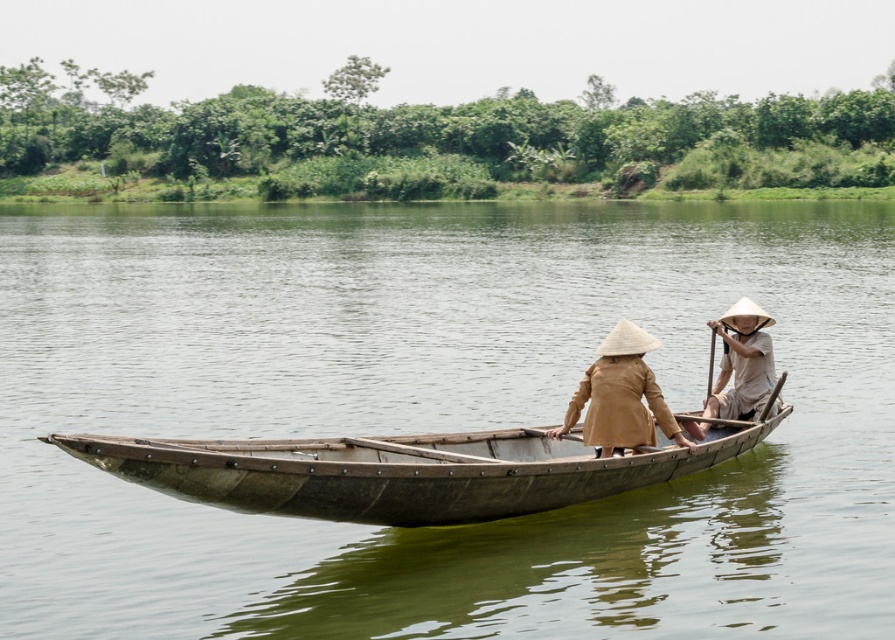
Identify the location of wooden canoe at center. Image resolution: width=895 pixels, height=640 pixels. (398, 472).

The image size is (895, 640). What do you see at coordinates (398, 472) in the screenshot? I see `wooden canoe at center` at bounding box center [398, 472].

Locate an element on the screen. This screenshot has width=895, height=640. wooden canoe at center is located at coordinates (398, 472).

Between brown matte conical hat at center and light brown wooden paddle at right, which one appears on the right side from the viewer's perspective?

light brown wooden paddle at right is more to the right.

The width and height of the screenshot is (895, 640). What do you see at coordinates (621, 396) in the screenshot?
I see `brown matte conical hat at center` at bounding box center [621, 396].

At what (x,y) coordinates should I click in order to perform the action: click on brown matte conical hat at center. Please return your answer as a coordinate pair (x, y). The image size is (895, 640). Looking at the image, I should click on (621, 396).

Is point (297, 493) behind point (744, 396)?

No, it is in front of (744, 396).

Is wooden canoe at center further to the viewer compared to light brown wooden paddle at right?

No, it is in front of light brown wooden paddle at right.

The width and height of the screenshot is (895, 640). Identify the location of wooden canoe at center. (398, 472).

Find the location of a particular element. The height and width of the screenshot is (640, 895). wooden canoe at center is located at coordinates (398, 472).